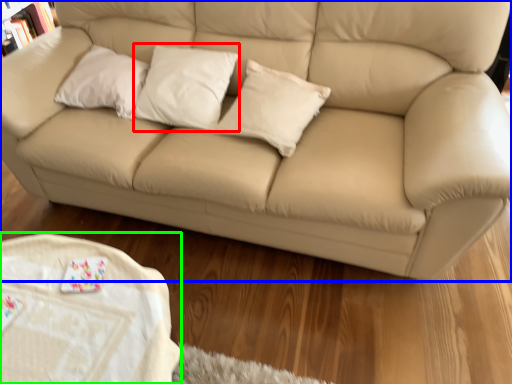
Question: Considering the real-world distances, which object is closest to pillow (highlighted by a red box)? studio couch (highlighted by a blue box) or table (highlighted by a green box).

Choices:
 (A) studio couch
 (B) table

Answer: (A)